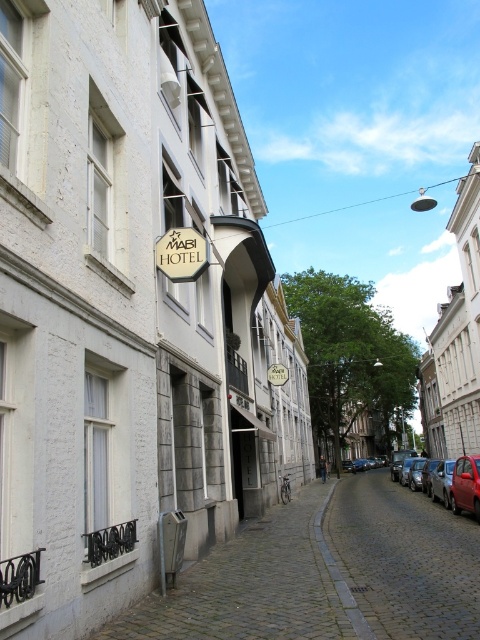
Is white stone hotel at center below white stone building at upper right?

Correct, white stone hotel at center is located below white stone building at upper right.

Is point (60, 252) positioned in front of point (465, 182)?

Yes.

Find the location of a particular element. The height and width of the screenshot is (640, 480). white stone hotel at center is located at coordinates (129, 312).

Which is below, red matte car at right or matte gold hotel sign at center?

red matte car at right is lower down.

Based on the photo, is red matte car at right positioned before matte gold hotel sign at center?

Yes, red matte car at right is in front of matte gold hotel sign at center.

Where is `red matte car at right`? The height and width of the screenshot is (640, 480). red matte car at right is located at coordinates (457, 484).

Which is more to the right, white stone building at upper right or red matte car at right?

From the viewer's perspective, white stone building at upper right appears more on the right side.

Who is shorter, white stone building at upper right or red matte car at right?

Standing shorter between the two is red matte car at right.

Where is `white stone building at upper right`? Image resolution: width=480 pixels, height=640 pixels. white stone building at upper right is located at coordinates (456, 337).